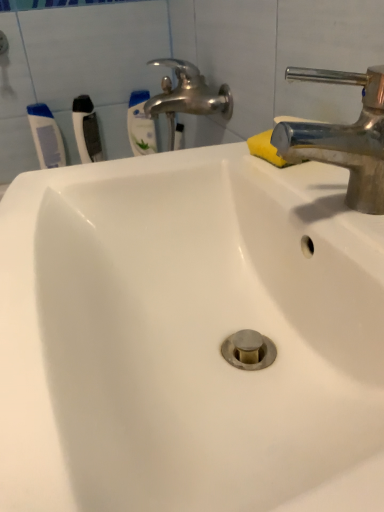
Question: Does white plastic toothbrush at upper left, acting as the second toothbrush starting from the right, lie in front of white plastic toothbrush at upper left, acting as the first toothbrush starting from the left?

Choices:
 (A) yes
 (B) no

Answer: (A)

Question: From the image's perspective, is white plastic toothbrush at upper left, the second toothbrush from the left, on top of white plastic toothbrush at upper left, acting as the first toothbrush starting from the left?

Choices:
 (A) no
 (B) yes

Answer: (B)

Question: Does white plastic toothbrush at upper left, acting as the second toothbrush starting from the right, have a greater width compared to white plastic toothbrush at upper left, which is the third toothbrush in right-to-left order?

Choices:
 (A) yes
 (B) no

Answer: (A)

Question: From the image's perspective, would you say white plastic toothbrush at upper left, the second toothbrush from the left, is shown under white plastic toothbrush at upper left, which is the third toothbrush in right-to-left order?

Choices:
 (A) yes
 (B) no

Answer: (B)

Question: Is white plastic toothbrush at upper left, acting as the second toothbrush starting from the right, oriented away from white plastic toothbrush at upper left, acting as the first toothbrush starting from the left?

Choices:
 (A) no
 (B) yes

Answer: (A)

Question: Which is correct: yellow sponge at upper right is inside white plastic toothbrush at upper left, which is the third toothbrush from left to right, or outside of it?

Choices:
 (A) outside
 (B) inside

Answer: (A)

Question: From a real-world perspective, is yellow sponge at upper right above or below white plastic toothbrush at upper left, which ranks as the 1th toothbrush in right-to-left order?

Choices:
 (A) below
 (B) above

Answer: (B)

Question: From the image's perspective, is yellow sponge at upper right positioned above or below white plastic toothbrush at upper left, which is the third toothbrush from left to right?

Choices:
 (A) above
 (B) below

Answer: (B)

Question: Would you say yellow sponge at upper right is to the left or to the right of white plastic toothbrush at upper left, which is the third toothbrush from left to right, in the picture?

Choices:
 (A) left
 (B) right

Answer: (B)

Question: Is polished chrome tap at upper right spatially inside white plastic toothbrush at upper left, acting as the first toothbrush starting from the left, or outside of it?

Choices:
 (A) inside
 (B) outside

Answer: (B)

Question: Considering their positions, is polished chrome tap at upper right located in front of or behind white plastic toothbrush at upper left, which is the third toothbrush in right-to-left order?

Choices:
 (A) behind
 (B) front

Answer: (B)

Question: Is polished chrome tap at upper right taller or shorter than white plastic toothbrush at upper left, acting as the first toothbrush starting from the left?

Choices:
 (A) short
 (B) tall

Answer: (A)

Question: From a real-world perspective, relative to white plastic toothbrush at upper left, which is the third toothbrush in right-to-left order, is polished chrome tap at upper right vertically above or below?

Choices:
 (A) below
 (B) above

Answer: (B)

Question: In the image, is polished chrome tap at upper right positioned in front of or behind white plastic toothbrush at upper left, acting as the second toothbrush starting from the right?

Choices:
 (A) front
 (B) behind

Answer: (A)

Question: Considering the positions of polished chrome tap at upper right and white plastic toothbrush at upper left, acting as the second toothbrush starting from the right, in the image, is polished chrome tap at upper right bigger or smaller than white plastic toothbrush at upper left, acting as the second toothbrush starting from the right,?

Choices:
 (A) small
 (B) big

Answer: (B)